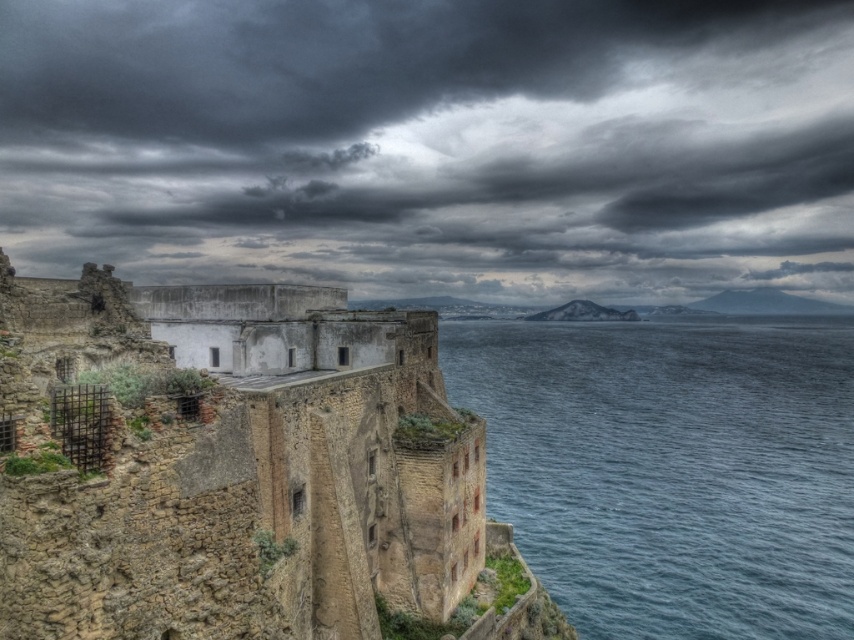
You are standing on the cliff and looking at the weathered stone structure. There is a point marked at coordinates (433, 145). What is the color of the object at this point?

The point at coordinates (433, 145) is located on a dark gray cloud at upper center.

You are a weather observer standing on the cliff edge. You notice the dark gray cloud at upper center and the brown stone fort at center. Which one has a greater width?

The dark gray cloud at upper center has a greater width than the brown stone fort at center according to the description.